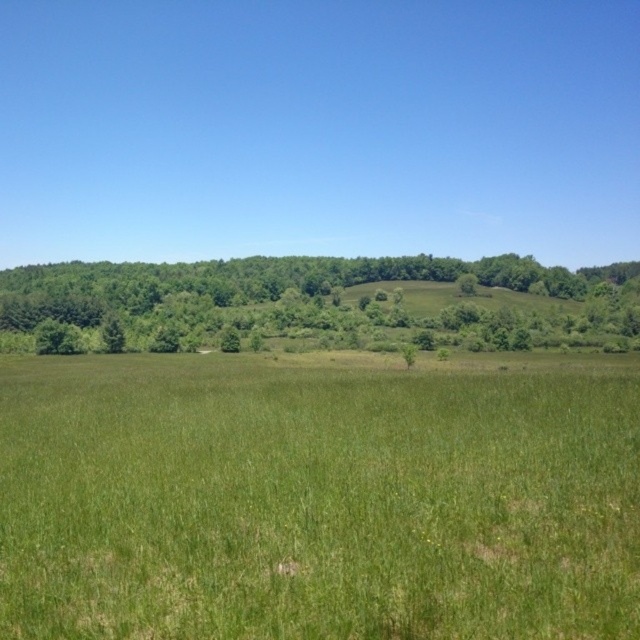
You are standing in the middle of the green grassy field at center and want to walk towards the green leafy tree at upper center. Which direction should you walk to reach the tree?

The green leafy tree at upper center is located at the upper center, so you should walk forward towards the upper center direction to reach it.

You are standing at the point marked by the coordinate point at [316,500] in the image. Looking around, what do you see immediately around you?

The point at [316,500] marks the green grassy field at center, so you are surrounded by lush green grass with some dry or browned edges, and there are a few small isolated trees scattered around you.

You are standing in the middle of the green grassy field at center and want to walk towards the green leafy tree at upper center. Which direction should you head?

You should head towards the upper center direction since the green leafy tree at upper center is located there.